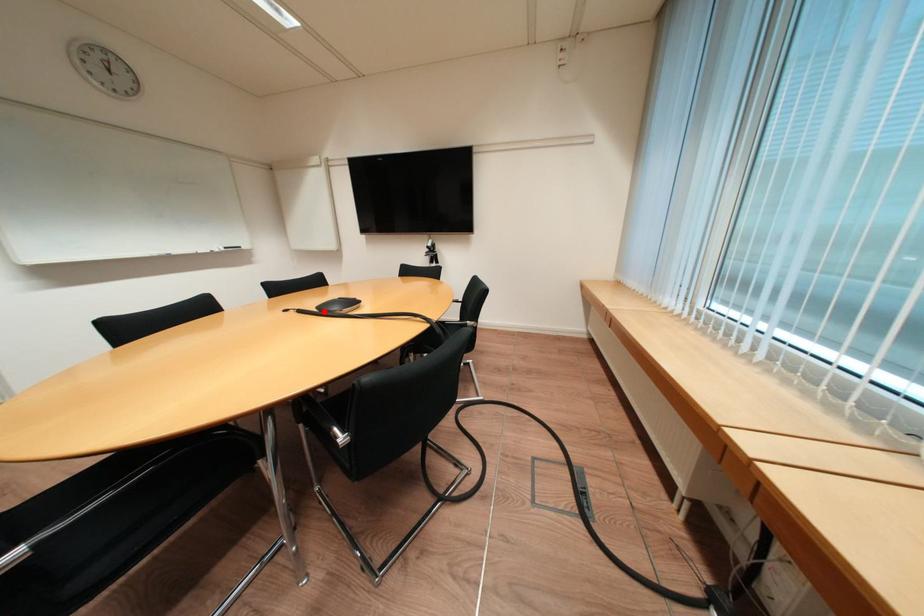
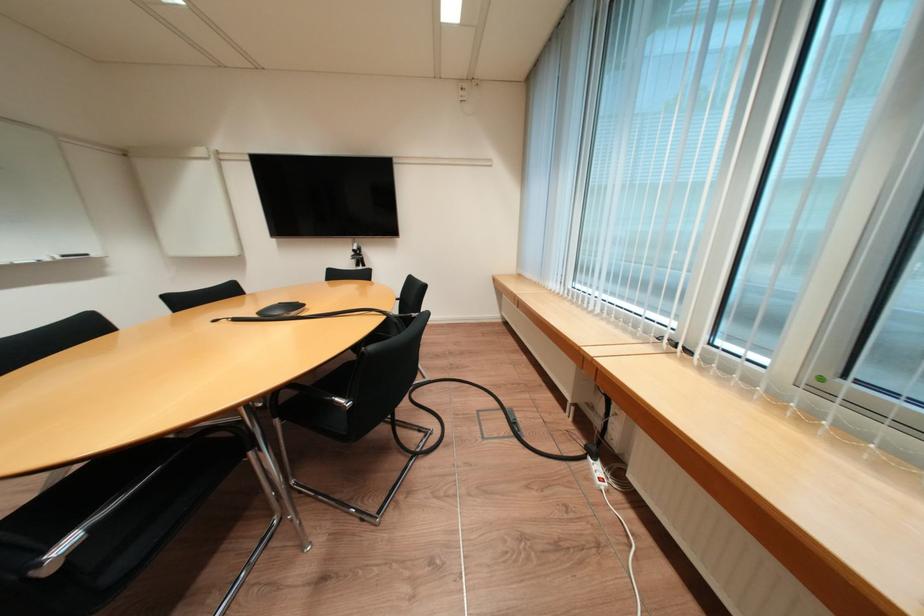
The point at the highlighted location is marked in the first image. Where is the corresponding point in the second image?

(265, 318)